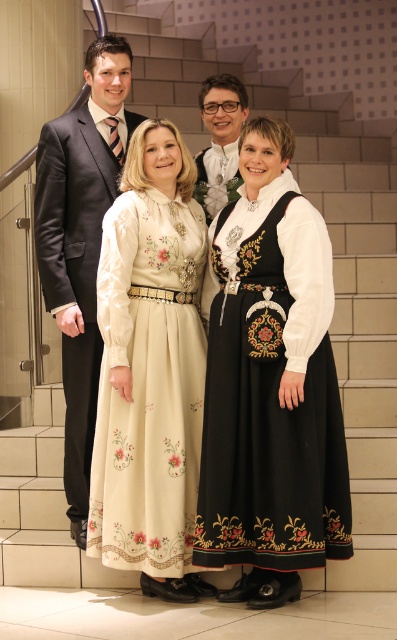
Question: Does black satin dress at center have a greater width compared to cream satin dress at center?

Choices:
 (A) yes
 (B) no

Answer: (A)

Question: Which of the following is the farthest from the observer?

Choices:
 (A) (314, 410)
 (B) (65, 266)
 (C) (231, 152)
 (D) (265, 536)

Answer: (C)

Question: Does black satin dress at center appear over cream satin dress at center?

Choices:
 (A) yes
 (B) no

Answer: (A)

Question: Considering the real-world distances, which object is closest to the matte black suit at left?

Choices:
 (A) embroidered silk dress at center
 (B) cream satin dress at center
 (C) black satin dress at center
 (D) matte white shirt at center

Answer: (B)

Question: Is embroidered silk dress at center positioned at the back of black satin dress at center?

Choices:
 (A) yes
 (B) no

Answer: (B)

Question: Which object is closer to the camera taking this photo?

Choices:
 (A) matte white shirt at center
 (B) embroidered silk dress at center
 (C) cream satin dress at center
 (D) black satin dress at center

Answer: (B)